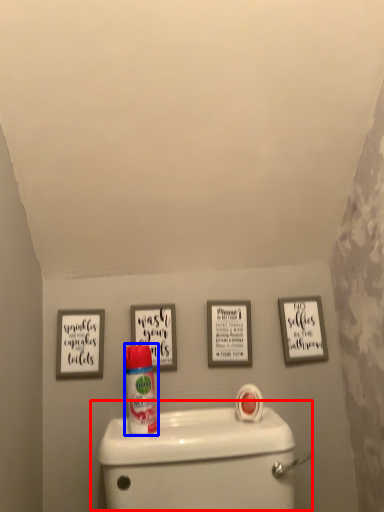
Question: Which object appears closest to the camera in this image, toilet (highlighted by a red box) or cleaning product (highlighted by a blue box)?

Choices:
 (A) toilet
 (B) cleaning product

Answer: (A)